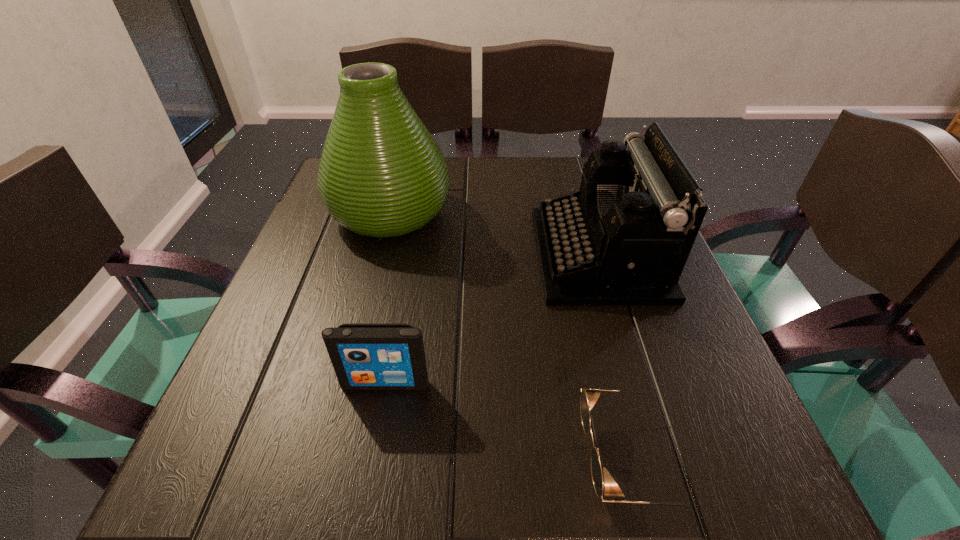
Locate an element on the screen. Image resolution: width=960 pixels, height=540 pixels. vacant space located on the front screen of the third farthest object is located at coordinates (361, 512).

Find the location of a particular element. free point located 0.070m on the front lenses of the shortest object is located at coordinates click(x=531, y=458).

I want to click on vacant region located 0.350m on the front lenses of the shortest object, so click(321, 458).

In order to click on vacant space located on the front lenses of the shortest object in this screenshot , I will do `click(321, 458)`.

Locate an element on the screen. This screenshot has height=540, width=960. object that is positioned at the far edge is located at coordinates [x=381, y=174].

Identify the location of object present at the near edge. The image size is (960, 540). (589, 397).

The image size is (960, 540). Identify the location of vase that is at the left edge. (381, 174).

You are a GUI agent. You are given a task and a screenshot of the screen. Output one action in this format:
    pyautogui.click(x=<x>, y=<y>)
    Task: Click on the iPod situated at the left edge
    
    Given the screenshot: What is the action you would take?
    pyautogui.click(x=364, y=356)

The image size is (960, 540). I want to click on typewriter that is at the right edge, so click(623, 239).

Locate an element on the screen. The height and width of the screenshot is (540, 960). sunglasses that is at the right edge is located at coordinates (589, 397).